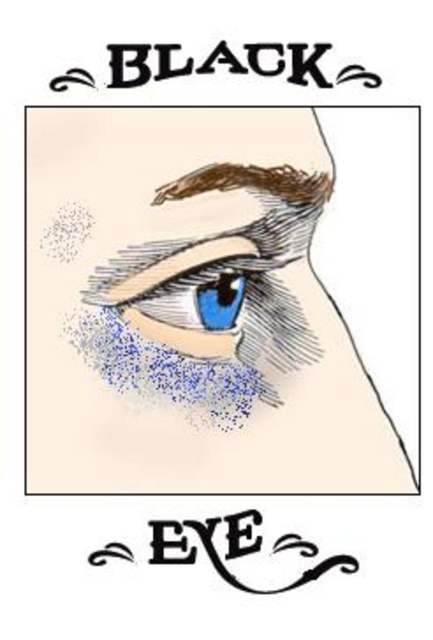
You are an optometrist examining a patient. The patient has a matte black eye at upper center. If the standard distance for an eye exam is 20 inches, is the patient positioned closer or farther than the recommended distance?

The distance between the matte black eye at upper center and the viewer is 17.45 inches, which is closer than the recommended 20 inches for an eye exam.

You are an artist trying to paint the eye in the image. You have two points to consider for adding highlights. The first point is at point [174,252] and the second is at point [294,184]. Which point should you choose to place a highlight that appears closer to the viewer?

Point [174,252] is closer to the camera than point [294,184], so you should choose point [174,252] to place the highlight that appears closer to the viewer.